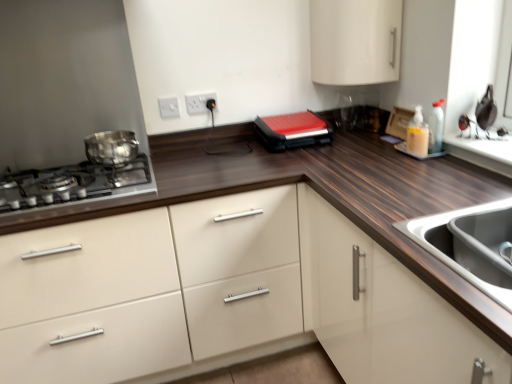
Question: Is white glossy cabinet at upper center, placed as the 2th cabinetry when sorted from bottom to top, to the left of shiny metallic gas stove at left from the viewer's perspective?

Choices:
 (A) no
 (B) yes

Answer: (A)

Question: Is white glossy cabinet at upper center, arranged as the 1th cabinetry when viewed from the top, directly adjacent to shiny metallic gas stove at left?

Choices:
 (A) yes
 (B) no

Answer: (B)

Question: Is white glossy cabinet at upper center, placed as the 2th cabinetry when sorted from bottom to top, further to the viewer compared to shiny metallic gas stove at left?

Choices:
 (A) yes
 (B) no

Answer: (A)

Question: Is white glossy cabinet at upper center, arranged as the 1th cabinetry when viewed from the top, completely or partially outside of shiny metallic gas stove at left?

Choices:
 (A) yes
 (B) no

Answer: (A)

Question: Is white glossy cabinet at upper center, arranged as the 1th cabinetry when viewed from the top, aimed at shiny metallic gas stove at left?

Choices:
 (A) no
 (B) yes

Answer: (A)

Question: From a real-world perspective, is white glossy cabinet at upper center, arranged as the 1th cabinetry when viewed from the top, over shiny metallic gas stove at left?

Choices:
 (A) yes
 (B) no

Answer: (A)

Question: Does translucent plastic soap dispenser at upper right appear on the left side of red matte sandwich maker at center?

Choices:
 (A) no
 (B) yes

Answer: (A)

Question: From the image's perspective, does translucent plastic soap dispenser at upper right appear higher than red matte sandwich maker at center?

Choices:
 (A) no
 (B) yes

Answer: (A)

Question: From a real-world perspective, is translucent plastic soap dispenser at upper right located beneath red matte sandwich maker at center?

Choices:
 (A) yes
 (B) no

Answer: (B)

Question: Does translucent plastic soap dispenser at upper right have a greater width compared to red matte sandwich maker at center?

Choices:
 (A) yes
 (B) no

Answer: (B)

Question: From a real-world perspective, is translucent plastic soap dispenser at upper right positioned over red matte sandwich maker at center based on gravity?

Choices:
 (A) no
 (B) yes

Answer: (B)

Question: Considering the relative sizes of translucent plastic soap dispenser at upper right and red matte sandwich maker at center in the image provided, is translucent plastic soap dispenser at upper right shorter than red matte sandwich maker at center?

Choices:
 (A) yes
 (B) no

Answer: (B)

Question: Is translucent plastic soap dispenser at upper right at the left side of shiny metallic pot at left?

Choices:
 (A) no
 (B) yes

Answer: (A)